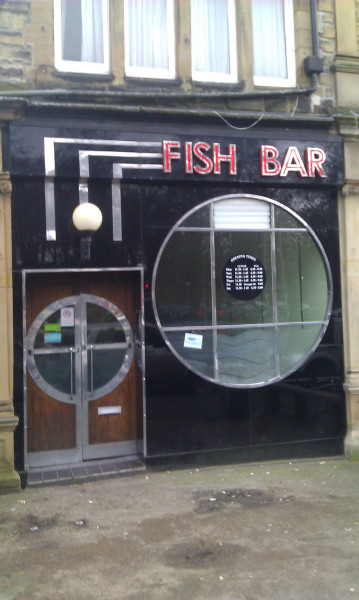
Identify the location of rectangle window. The image size is (359, 600). (199, 52).